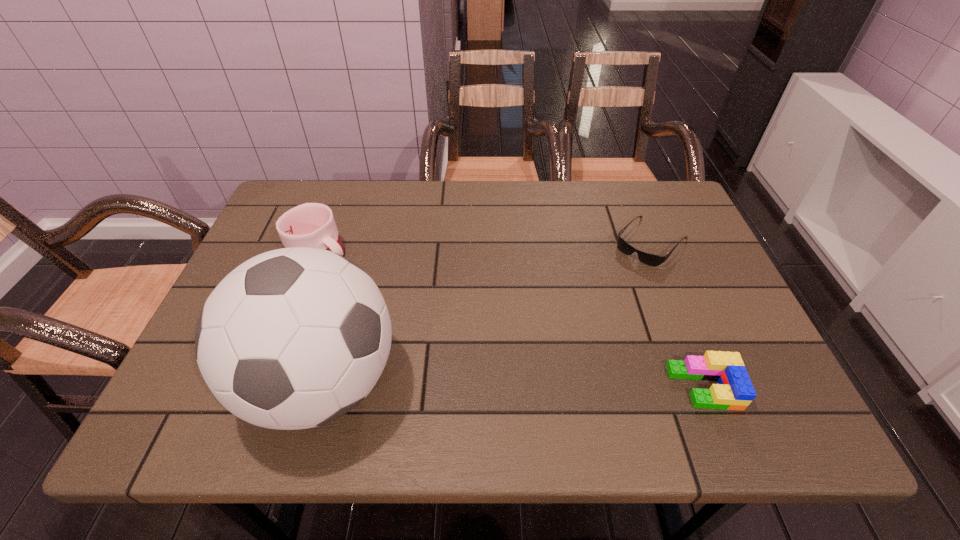
Locate an element on the screen. The width and height of the screenshot is (960, 540). free space that satisfies the following two spatial constraints: 1. on the front side of the tallest object; 2. on the left side of the second tallest object is located at coordinates (273, 383).